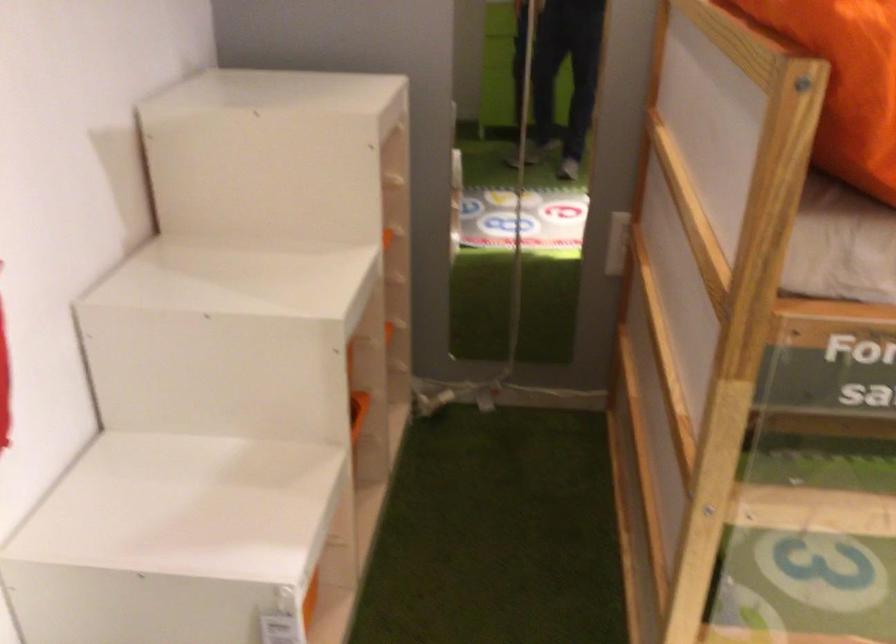
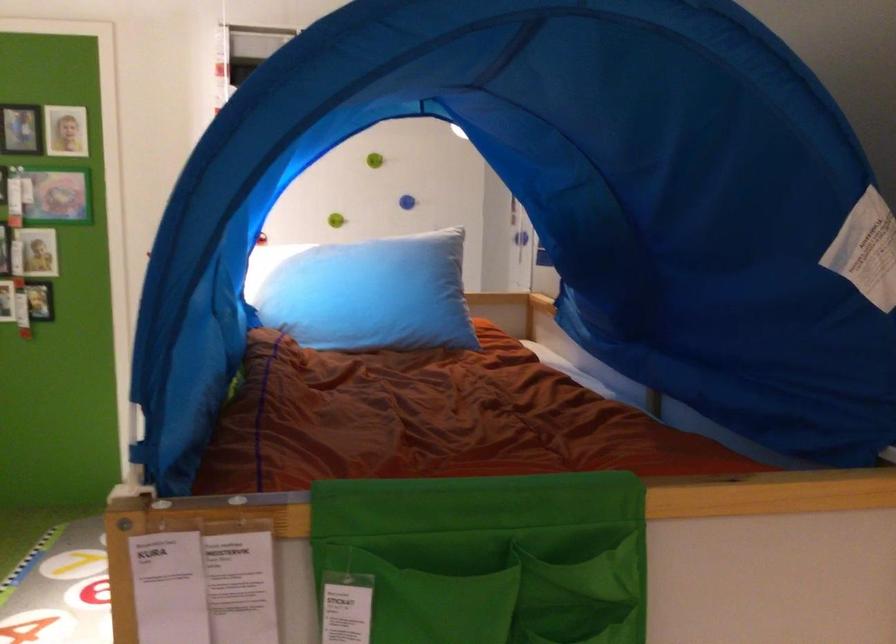
Question: I am providing you with two images of the same scene from different viewpoints. Which of the following objects are not visible in image2?

Choices:
 (A) orange storage bin
 (B) patterned laundry hamper
 (C) light blue pillow
 (D) small picture frame

Answer: (A)